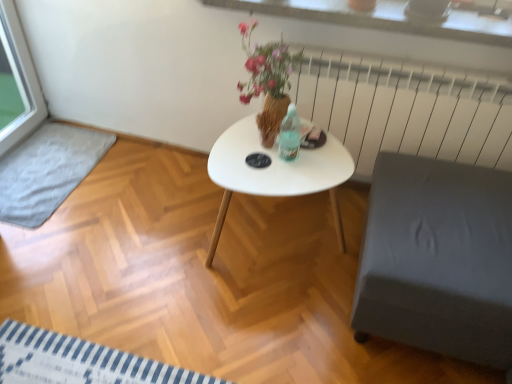
At what (x,y) coordinates should I click in order to perform the action: click on vacant space positioned to the left of gray fabric ottoman at lower right. Please return your answer as a coordinate pair (x, y). Image resolution: width=512 pixels, height=384 pixels. Looking at the image, I should click on (279, 327).